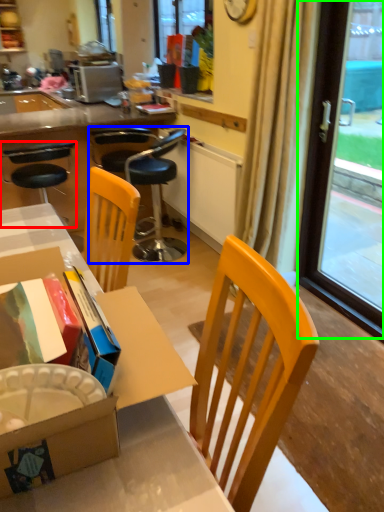
Question: Estimate the real-world distances between objects in this image. Which object is farther from chair (highlighted by a red box), chair (highlighted by a blue box) or window screen (highlighted by a green box)?

Choices:
 (A) chair
 (B) window screen

Answer: (B)